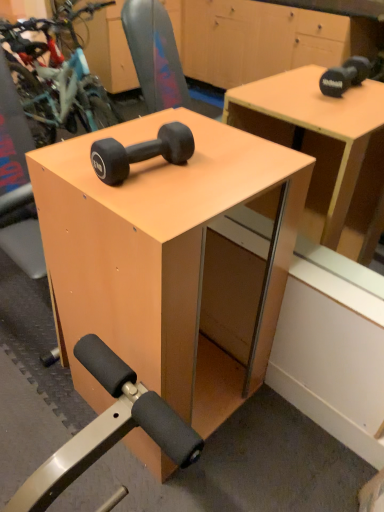
The height and width of the screenshot is (512, 384). I want to click on vacant area that is situated to the right of matte black dumbbell at center, so click(x=212, y=173).